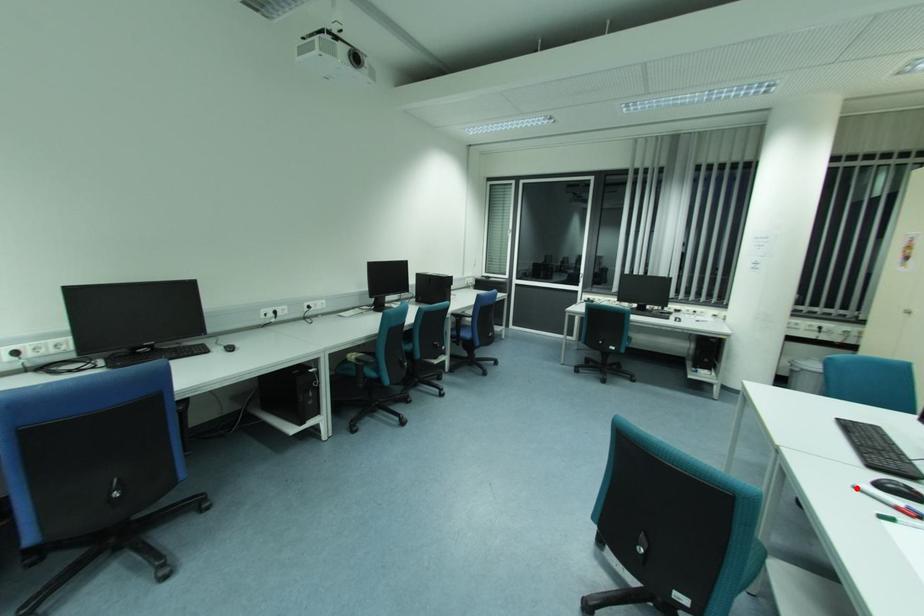
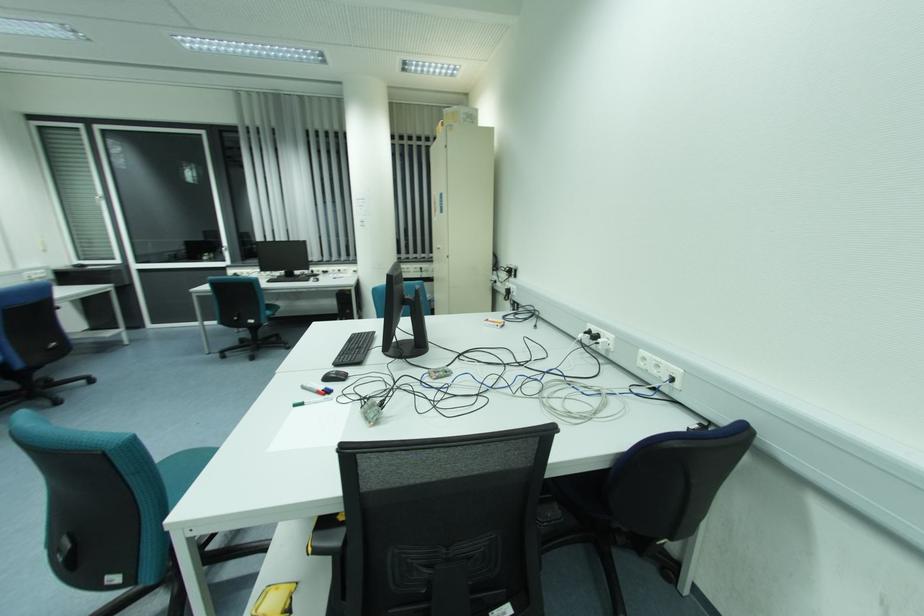
In the second image, find the point that corresponds to the highlighted location in the first image.

(304, 389)